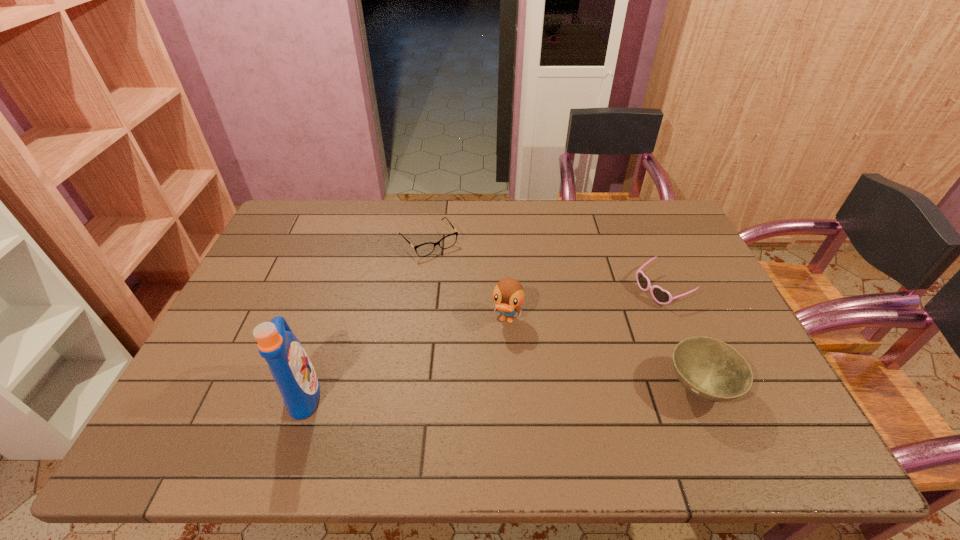
I want to click on free space on the desktop that is between the leftmost object and the bowl and is positioned on the front-facing side of the third object from left to right, so click(483, 390).

Locate an element on the screen. Image resolution: width=960 pixels, height=540 pixels. vacant space on the desktop that is between the tallest object and the third tallest object and is positioned on the front-facing side of the sunglasses is located at coordinates (463, 391).

You are a GUI agent. You are given a task and a screenshot of the screen. Output one action in this format:
    pyautogui.click(x=<x>, y=<y>)
    Task: Click on the vacant space on the desktop that is between the detergent and the third tallest object and is positioned on the front-facing side of the shortest object
    
    Given the screenshot: What is the action you would take?
    point(547,390)